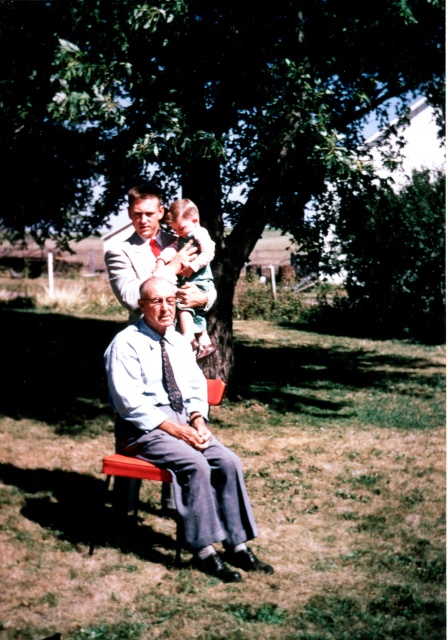
Question: Considering the real-world distances, which object is closest to the light blue fabric shirt at center?

Choices:
 (A) dark gray textured tie at center
 (B) green leafy tree at upper center
 (C) light brown fabric baby at upper center

Answer: (A)

Question: Which of the following is the farthest from the observer?

Choices:
 (A) (294, 99)
 (B) (206, 342)

Answer: (A)

Question: Does light brown fabric baby at upper center have a greater width compared to dark gray textured tie at center?

Choices:
 (A) no
 (B) yes

Answer: (B)

Question: Is green leafy tree at upper center further to camera compared to light brown fabric baby at upper center?

Choices:
 (A) no
 (B) yes

Answer: (B)

Question: Can you confirm if green leafy tree at upper center is wider than light blue fabric shirt at center?

Choices:
 (A) yes
 (B) no

Answer: (A)

Question: Among these points, which one is farthest from the camera?

Choices:
 (A) (198, 285)
 (B) (132, 33)
 (C) (112, 346)
 (D) (169, 374)

Answer: (B)